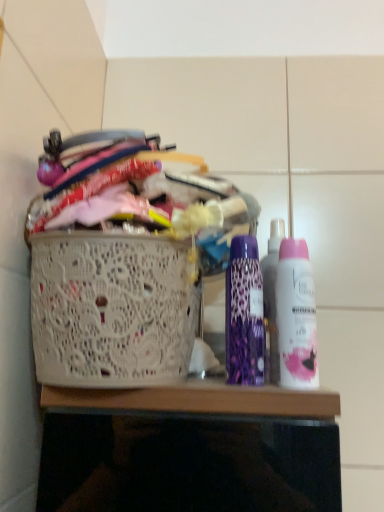
Locate an element on the screen. This screenshot has height=512, width=384. purple leopard print deodorant at center, the second bottle in the right-to-left sequence is located at coordinates (244, 314).

Identify the location of purple leopard print deodorant at center, positioned as the 1th bottle in left-to-right order. (244, 314).

Is purple leopard print deodorant at center, positioned as the 1th bottle in left-to-right order, outside of pink matte deodorant at right, the 2th bottle in the left-to-right sequence?

Yes, purple leopard print deodorant at center, positioned as the 1th bottle in left-to-right order, is not within pink matte deodorant at right, the 2th bottle in the left-to-right sequence.

From the image's perspective, relative to pink matte deodorant at right, which appears as the first bottle when viewed from the right, is purple leopard print deodorant at center, the second bottle in the right-to-left sequence, above or below?

Based on their image positions, purple leopard print deodorant at center, the second bottle in the right-to-left sequence, is located above pink matte deodorant at right, which appears as the first bottle when viewed from the right.

From a real-world perspective, is purple leopard print deodorant at center, the second bottle in the right-to-left sequence, physically located above or below pink matte deodorant at right, which appears as the first bottle when viewed from the right?

Clearly, from a real-world perspective, purple leopard print deodorant at center, the second bottle in the right-to-left sequence, is above pink matte deodorant at right, which appears as the first bottle when viewed from the right.

Which is nearer, (248, 356) or (291, 269)?

Point (248, 356) appears to be closer to the viewer than point (291, 269).

From the image's perspective, which is above, pink matte deodorant at right, which appears as the first bottle when viewed from the right, or white lace basket at left?

pink matte deodorant at right, which appears as the first bottle when viewed from the right, is shown above in the image.

From a real-world perspective, is pink matte deodorant at right, the 2th bottle in the left-to-right sequence, positioned above or below white lace basket at left?

pink matte deodorant at right, the 2th bottle in the left-to-right sequence, is situated higher than white lace basket at left in the real world.

From a real-world perspective, starting from the white lace basket at left, which bottle is the 1st one vertically above it? Please provide its 2D coordinates.

[(296, 316)]

Between white lace basket at left and purple leopard print deodorant at center, the second bottle in the right-to-left sequence, which one appears on the right side from the viewer's perspective?

From the viewer's perspective, purple leopard print deodorant at center, the second bottle in the right-to-left sequence, appears more on the right side.

Considering the relative sizes of white lace basket at left and purple leopard print deodorant at center, the second bottle in the right-to-left sequence, in the image provided, is white lace basket at left shorter than purple leopard print deodorant at center, the second bottle in the right-to-left sequence,?

In fact, white lace basket at left may be taller than purple leopard print deodorant at center, the second bottle in the right-to-left sequence.

Is purple leopard print deodorant at center, the second bottle in the right-to-left sequence, completely or partially inside white lace basket at left?

Definitely not — purple leopard print deodorant at center, the second bottle in the right-to-left sequence, is not inside white lace basket at left.

Is purple leopard print deodorant at center, positioned as the 1th bottle in left-to-right order, facing away from white lace basket at left?

No, white lace basket at left is not at the back of purple leopard print deodorant at center, positioned as the 1th bottle in left-to-right order.

Who is smaller, purple leopard print deodorant at center, positioned as the 1th bottle in left-to-right order, or white lace basket at left?

purple leopard print deodorant at center, positioned as the 1th bottle in left-to-right order, is smaller.

Between purple leopard print deodorant at center, positioned as the 1th bottle in left-to-right order, and white lace basket at left, which one has more height?

white lace basket at left is taller.

Looking at this image, are purple leopard print deodorant at center, the second bottle in the right-to-left sequence, and white lace basket at left far apart?

purple leopard print deodorant at center, the second bottle in the right-to-left sequence, is near white lace basket at left, not far away.

Is point (126, 249) positioned in front of point (290, 333)?

That is True.

Based on the photo, is white lace basket at left oriented away from pink matte deodorant at right, the 2th bottle in the left-to-right sequence?

That's not correct — white lace basket at left is not looking away from pink matte deodorant at right, the 2th bottle in the left-to-right sequence.

Considering the sizes of white lace basket at left and pink matte deodorant at right, the 2th bottle in the left-to-right sequence, in the image, is white lace basket at left bigger or smaller than pink matte deodorant at right, the 2th bottle in the left-to-right sequence,?

Considering their sizes, white lace basket at left takes up more space than pink matte deodorant at right, the 2th bottle in the left-to-right sequence.

Is purple leopard print deodorant at center, the second bottle in the right-to-left sequence, at the back of pink matte deodorant at right, the 2th bottle in the left-to-right sequence?

No, pink matte deodorant at right, the 2th bottle in the left-to-right sequence, is not facing away from purple leopard print deodorant at center, the second bottle in the right-to-left sequence.

From a real-world perspective, relative to purple leopard print deodorant at center, the second bottle in the right-to-left sequence, is pink matte deodorant at right, which appears as the first bottle when viewed from the right, vertically above or below?

pink matte deodorant at right, which appears as the first bottle when viewed from the right, is situated lower than purple leopard print deodorant at center, the second bottle in the right-to-left sequence, in the real world.

From the picture: Is pink matte deodorant at right, the 2th bottle in the left-to-right sequence, outside of purple leopard print deodorant at center, the second bottle in the right-to-left sequence?

Yes, pink matte deodorant at right, the 2th bottle in the left-to-right sequence, is not within purple leopard print deodorant at center, the second bottle in the right-to-left sequence.

From the image's perspective, does pink matte deodorant at right, which appears as the first bottle when viewed from the right, appear lower than purple leopard print deodorant at center, the second bottle in the right-to-left sequence?

Correct, pink matte deodorant at right, which appears as the first bottle when viewed from the right, appears lower than purple leopard print deodorant at center, the second bottle in the right-to-left sequence, in the image.

At what (x,y) coordinates should I click in order to perform the action: click on bottle on the left of pink matte deodorant at right, which appears as the first bottle when viewed from the right. Please return your answer as a coordinate pair (x, y). The width and height of the screenshot is (384, 512). Looking at the image, I should click on (244, 314).

Where is `the 2nd bottle to the right of the white lace basket at left, starting your count from the anchor`? the 2nd bottle to the right of the white lace basket at left, starting your count from the anchor is located at coordinates (296, 316).

Estimate the real-world distances between objects in this image. Which object is closer to pink matte deodorant at right, which appears as the first bottle when viewed from the right, purple leopard print deodorant at center, positioned as the 1th bottle in left-to-right order, or white lace basket at left?

purple leopard print deodorant at center, positioned as the 1th bottle in left-to-right order, is closer to pink matte deodorant at right, which appears as the first bottle when viewed from the right.

In the scene shown: Estimate the real-world distances between objects in this image. Which object is closer to purple leopard print deodorant at center, the second bottle in the right-to-left sequence, pink matte deodorant at right, the 2th bottle in the left-to-right sequence, or white lace basket at left?

Based on the image, pink matte deodorant at right, the 2th bottle in the left-to-right sequence, appears to be nearer to purple leopard print deodorant at center, the second bottle in the right-to-left sequence.

Considering their positions, is purple leopard print deodorant at center, positioned as the 1th bottle in left-to-right order, positioned closer to white lace basket at left than pink matte deodorant at right, which appears as the first bottle when viewed from the right?

Based on the image, purple leopard print deodorant at center, positioned as the 1th bottle in left-to-right order, appears to be nearer to white lace basket at left.

Looking at the image, which one is located closer to purple leopard print deodorant at center, positioned as the 1th bottle in left-to-right order, white lace basket at left or pink matte deodorant at right, which appears as the first bottle when viewed from the right?

pink matte deodorant at right, which appears as the first bottle when viewed from the right, is positioned closer to the anchor purple leopard print deodorant at center, positioned as the 1th bottle in left-to-right order.

Considering their positions, is pink matte deodorant at right, the 2th bottle in the left-to-right sequence, positioned further to white lace basket at left than purple leopard print deodorant at center, the second bottle in the right-to-left sequence?

pink matte deodorant at right, the 2th bottle in the left-to-right sequence, is positioned further to the anchor white lace basket at left.

Estimate the real-world distances between objects in this image. Which object is closer to pink matte deodorant at right, which appears as the first bottle when viewed from the right, white lace basket at left or purple leopard print deodorant at center, the second bottle in the right-to-left sequence?

The object closer to pink matte deodorant at right, which appears as the first bottle when viewed from the right, is purple leopard print deodorant at center, the second bottle in the right-to-left sequence.

The height and width of the screenshot is (512, 384). In order to click on bottle between white lace basket at left and pink matte deodorant at right, the 2th bottle in the left-to-right sequence, in the horizontal direction in this screenshot , I will do `click(244, 314)`.